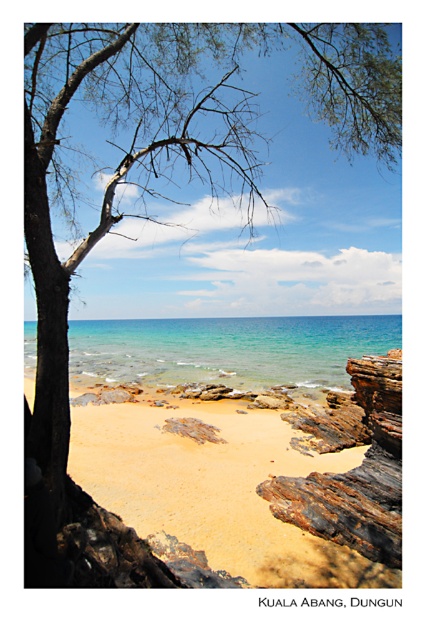
Consider the image. Does clear blue water at center appear on the right side of rusty wood rock at lower right?

In fact, clear blue water at center is to the left of rusty wood rock at lower right.

Between point (320, 330) and point (344, 522), which one is positioned in front?

Positioned in front is point (344, 522).

Is point (193, 356) less distant than point (383, 541)?

No.

The width and height of the screenshot is (428, 640). In order to click on clear blue water at center in this screenshot , I will do `click(229, 349)`.

This screenshot has height=640, width=428. What do you see at coordinates (214, 490) in the screenshot? I see `golden sand beach at center` at bounding box center [214, 490].

This screenshot has height=640, width=428. In order to click on golden sand beach at center in this screenshot , I will do `click(214, 490)`.

Identify the location of golden sand beach at center. (214, 490).

How distant is golden sand beach at center from rusty wood rock at lower right?

They are 2.21 meters apart.

Is point (329, 548) positioned before point (385, 451)?

That is True.

Locate an element on the screen. golden sand beach at center is located at coordinates (214, 490).